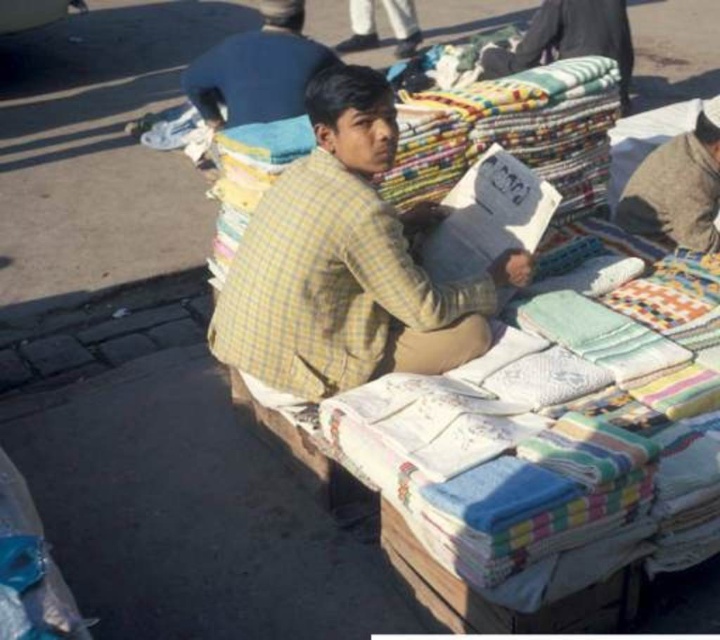
Between gray woolen hat at upper right and multicolored fabric at upper right, which one appears on the left side from the viewer's perspective?

gray woolen hat at upper right is more to the left.

Between point (675, 189) and point (513, 51), which one is positioned behind?

Point (513, 51)

Find the location of a particular element. gray woolen hat at upper right is located at coordinates pos(678,188).

Does multicolored fabric at upper right lie behind light blue fabric at upper center?

No, it is not.

Does multicolored fabric at upper right appear under light blue fabric at upper center?

Yes, multicolored fabric at upper right is below light blue fabric at upper center.

Is point (580, 22) behind point (415, 48)?

No, it is in front of (415, 48).

This screenshot has width=720, height=640. What are the coordinates of `multicolored fabric at upper right` in the screenshot? It's located at (570, 38).

What do you see at coordinates (346, 262) in the screenshot? I see `yellow checkered shirt at center` at bounding box center [346, 262].

Between yellow checkered shirt at center and light blue shirt at center, which one has more height?

yellow checkered shirt at center is taller.

Where is `yellow checkered shirt at center`? The image size is (720, 640). yellow checkered shirt at center is located at coordinates (346, 262).